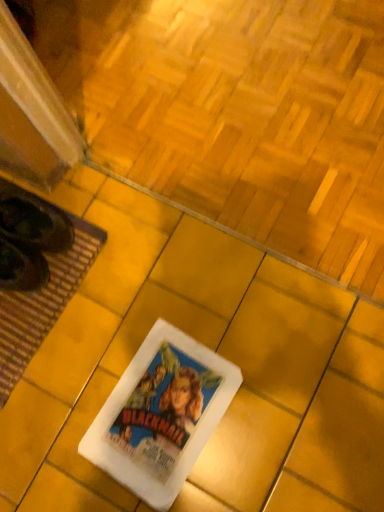
The height and width of the screenshot is (512, 384). Find the location of `vacant space situated above white paper movie poster at center (from a real-world perspective)`. vacant space situated above white paper movie poster at center (from a real-world perspective) is located at coordinates (162, 410).